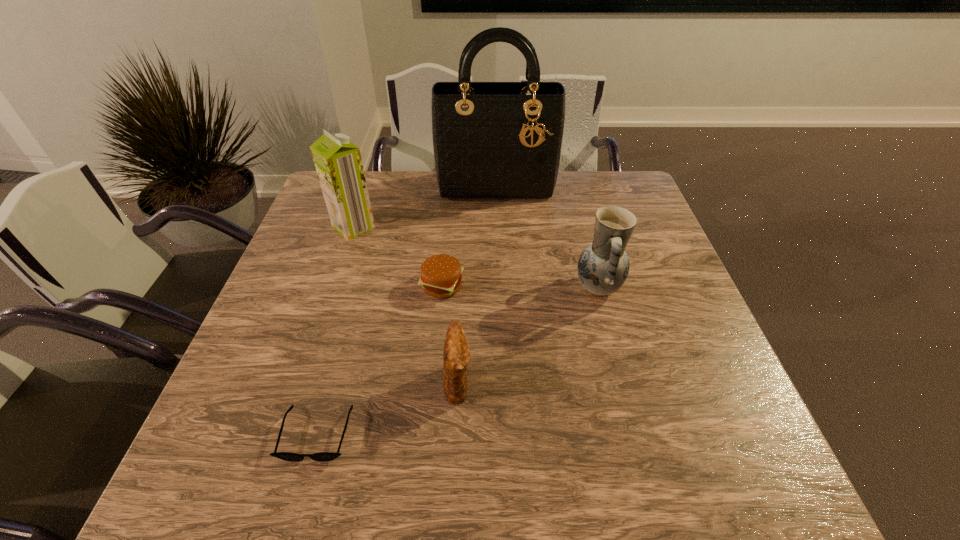
The height and width of the screenshot is (540, 960). Find the location of `handbag`. handbag is located at coordinates (497, 141).

This screenshot has width=960, height=540. What are the coordinates of `the farthest object` in the screenshot? It's located at pos(497,141).

Where is `soya milk`? soya milk is located at coordinates (338, 162).

Locate an element on the screen. The image size is (960, 540). the fifth nearest object is located at coordinates (338, 162).

Identify the location of the third tallest object. (603, 266).

Identify the location of the second nearest object. Image resolution: width=960 pixels, height=540 pixels. [x=456, y=356].

At what (x,y) coordinates should I click in order to perform the action: click on clutch bag. Please return your answer as a coordinate pair (x, y). The image size is (960, 540). Looking at the image, I should click on (456, 356).

Find the location of a particular element. This screenshot has width=960, height=540. hamburger is located at coordinates (441, 277).

The image size is (960, 540). Identify the location of the shortest object. (x=287, y=456).

Where is `the nearest object`? the nearest object is located at coordinates (287, 456).